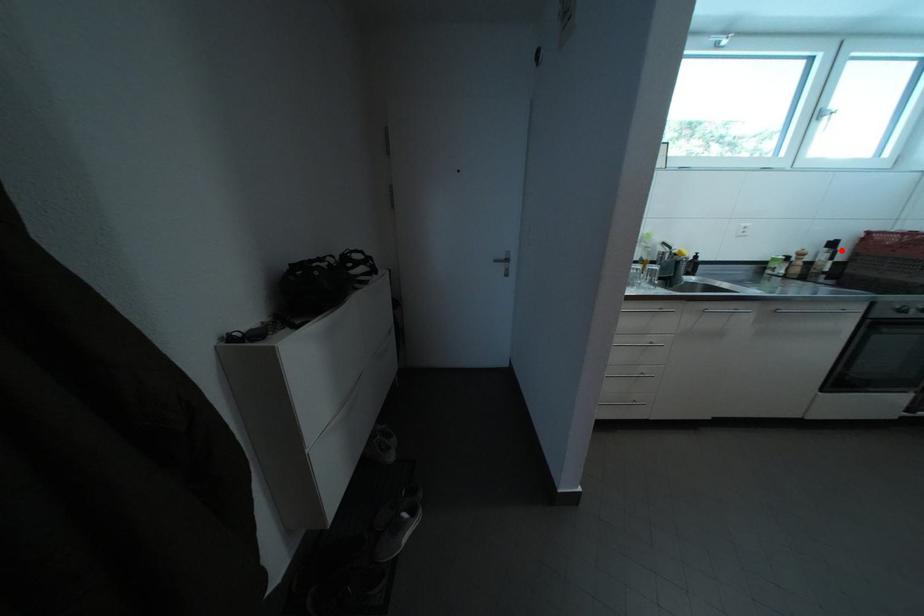
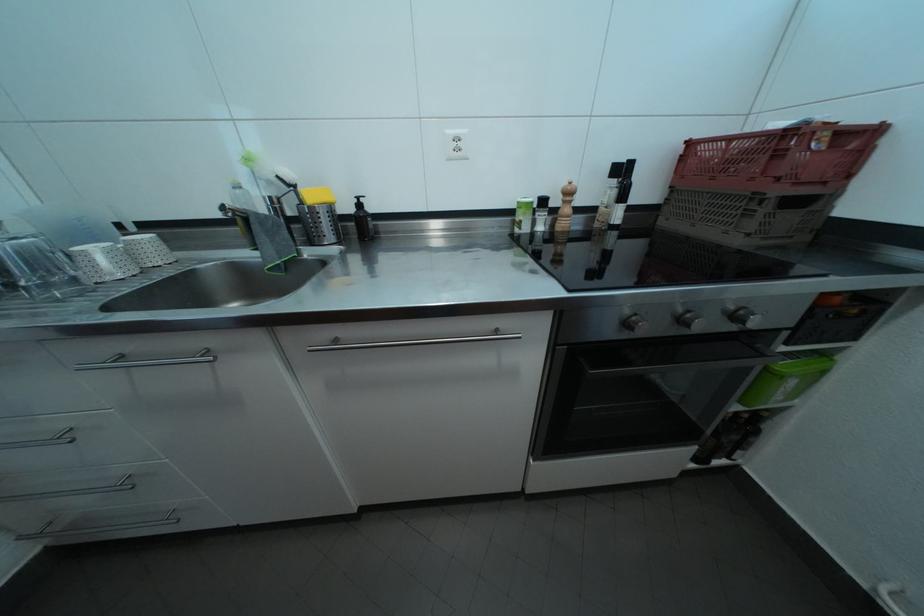
Find the pixel in the second image that matches the highlighted location in the first image.

(630, 176)